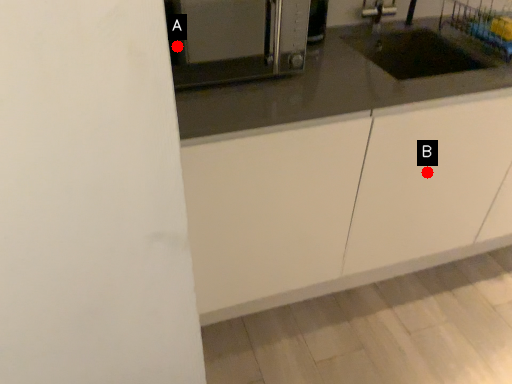
Question: Two points are circled on the image, labeled by A and B beside each circle. Which point is farther to the camera?

Choices:
 (A) A is further
 (B) B is further

Answer: (A)